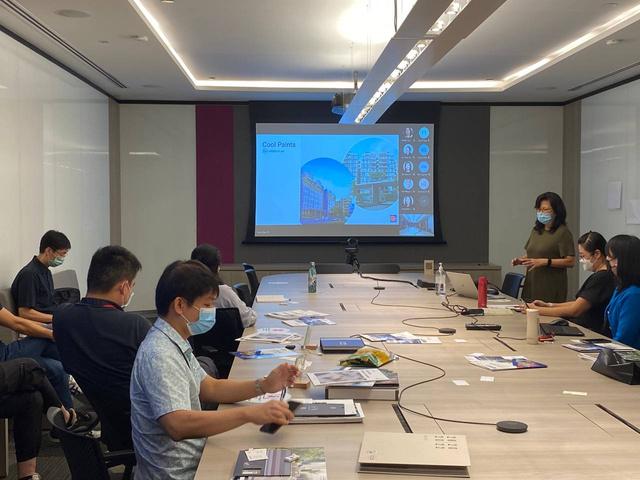
Identify the location of over-head lighting. (384, 76), (257, 81).